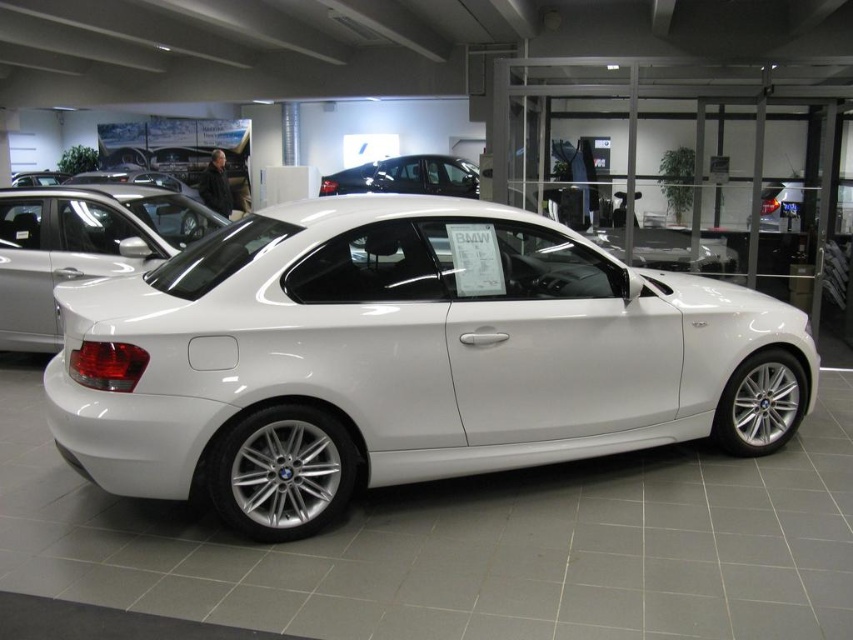
Does white glossy car at center lie behind glossy black car at center?

No.

Is white glossy car at center taller than glossy black car at center?

Yes.

What do you see at coordinates (403, 358) in the screenshot?
I see `white glossy car at center` at bounding box center [403, 358].

At what (x,y) coordinates should I click in order to perform the action: click on white glossy car at center. Please return your answer as a coordinate pair (x, y). Image resolution: width=853 pixels, height=640 pixels. Looking at the image, I should click on (403, 358).

Who is positioned more to the right, white glossy car at center or white metallic car at center?

white glossy car at center is more to the right.

Which of these two, white glossy car at center or white metallic car at center, stands shorter?

With less height is white metallic car at center.

Locate an element on the screen. white glossy car at center is located at coordinates (403, 358).

Does point (33, 252) come closer to viewer compared to point (434, 186)?

Yes, it is.

What are the coordinates of `white metallic car at center` in the screenshot? It's located at (80, 246).